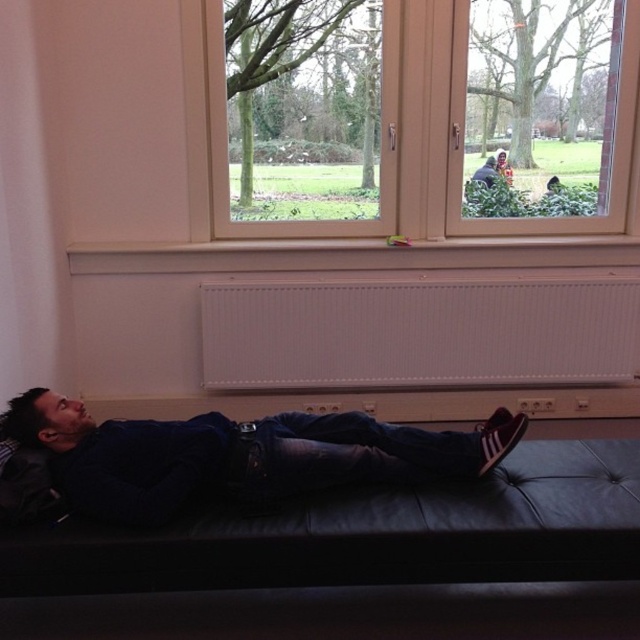
Question: Based on their relative distances, which object is nearer to the dark blue leather jacket at lower center?

Choices:
 (A) wooden frame window at upper center
 (B) black leather couch at lower center

Answer: (B)

Question: Does black leather couch at lower center have a greater width compared to dark blue leather jacket at lower center?

Choices:
 (A) yes
 (B) no

Answer: (A)

Question: Which point is closer to the camera taking this photo?

Choices:
 (A) (445, 22)
 (B) (83, 493)
 (C) (358, 556)

Answer: (C)

Question: Which point is farther from the camera taking this photo?

Choices:
 (A) (394, 508)
 (B) (108, 477)
 (C) (461, 250)

Answer: (C)

Question: Is black leather couch at lower center to the left of dark blue leather jacket at lower center from the viewer's perspective?

Choices:
 (A) yes
 (B) no

Answer: (B)

Question: Can you confirm if black leather couch at lower center is positioned above dark blue leather jacket at lower center?

Choices:
 (A) yes
 (B) no

Answer: (B)